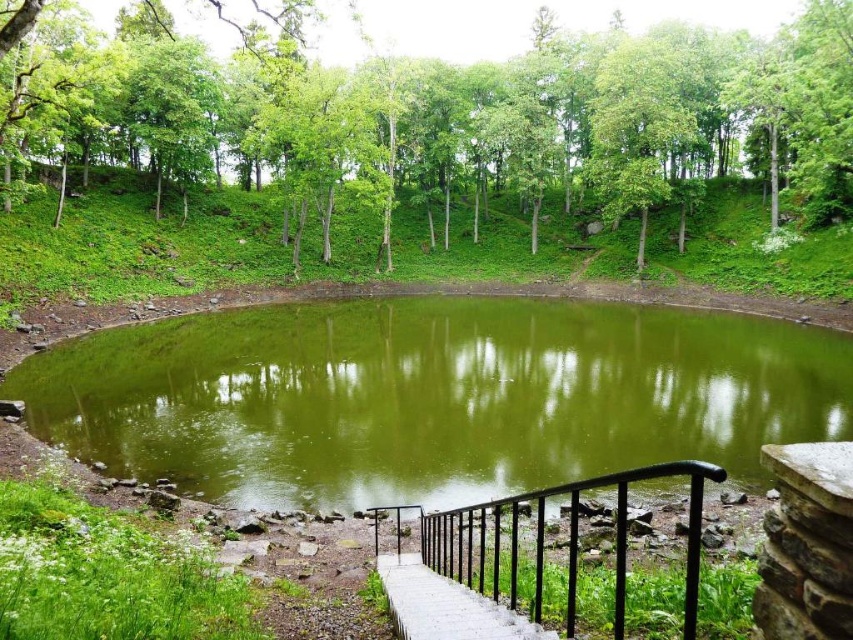
From the picture: Can you confirm if green leafy tree at upper center is positioned to the left of black metal railing at lower center?

Yes, green leafy tree at upper center is to the left of black metal railing at lower center.

Is the position of green leafy tree at upper center less distant than that of black metal railing at lower center?

No, green leafy tree at upper center is behind black metal railing at lower center.

The height and width of the screenshot is (640, 853). I want to click on green leafy tree at upper center, so coord(444,115).

What do you see at coordinates (431, 397) in the screenshot? This screenshot has height=640, width=853. I see `green water at center` at bounding box center [431, 397].

In the scene shown: Can you confirm if green water at center is positioned to the right of black metal railing at lower center?

Indeed, green water at center is positioned on the right side of black metal railing at lower center.

This screenshot has height=640, width=853. What do you see at coordinates (431, 397) in the screenshot? I see `green water at center` at bounding box center [431, 397].

The height and width of the screenshot is (640, 853). I want to click on green water at center, so [431, 397].

Which is more to the left, green water at center or green leafy tree at upper center?

Positioned to the left is green leafy tree at upper center.

Which is below, green water at center or green leafy tree at upper center?

green water at center is lower down.

Does point (596, 470) come closer to viewer compared to point (106, 45)?

Yes, it is.

The width and height of the screenshot is (853, 640). I want to click on green water at center, so click(431, 397).